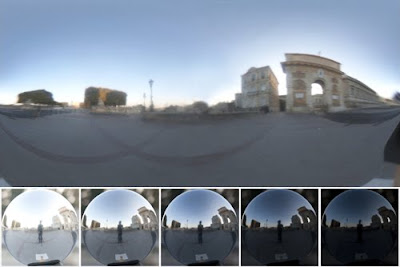
Find the location of `mirror`. mirror is located at coordinates (31, 202), (113, 218), (192, 213), (293, 215), (340, 211).